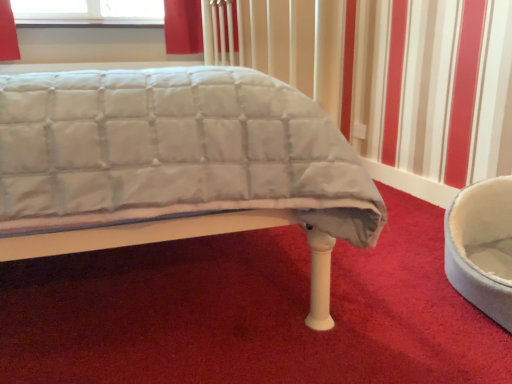
Question: In terms of width, does white plush bean bag at right look wider or thinner when compared to white quilted fabric bed at center?

Choices:
 (A) thin
 (B) wide

Answer: (A)

Question: Is point (501, 215) closer or farther from the camera than point (232, 213)?

Choices:
 (A) farther
 (B) closer

Answer: (A)

Question: From a real-world perspective, relative to white quilted fabric bed at center, is white plush bean bag at right vertically above or below?

Choices:
 (A) above
 (B) below

Answer: (B)

Question: From the image's perspective, relative to white plush bean bag at right, is white quilted fabric bed at center above or below?

Choices:
 (A) above
 (B) below

Answer: (A)

Question: In terms of width, does white quilted fabric bed at center look wider or thinner when compared to white plush bean bag at right?

Choices:
 (A) wide
 (B) thin

Answer: (A)

Question: Is white quilted fabric bed at center taller or shorter than white plush bean bag at right?

Choices:
 (A) short
 (B) tall

Answer: (B)

Question: Does point (113, 236) appear closer or farther from the camera than point (503, 196)?

Choices:
 (A) closer
 (B) farther

Answer: (A)